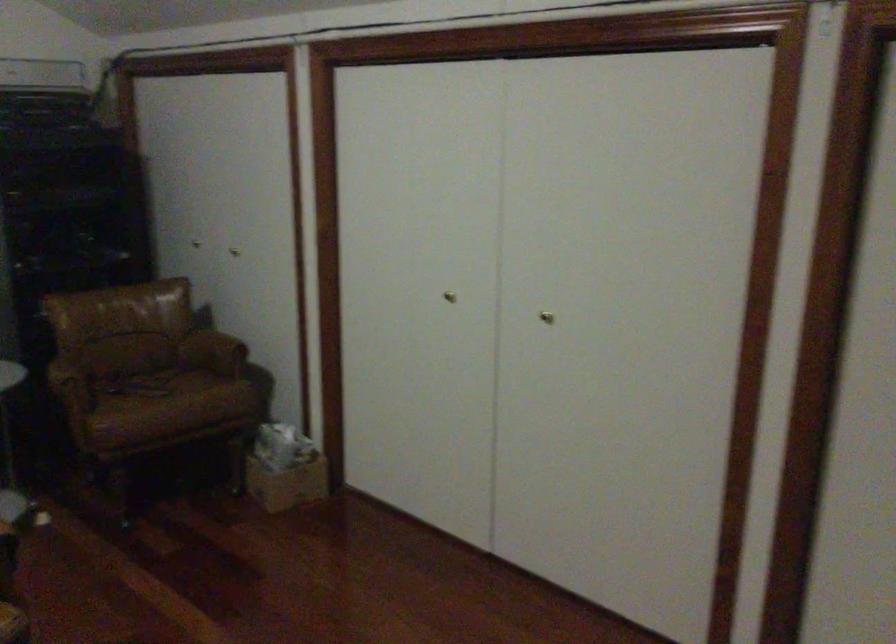
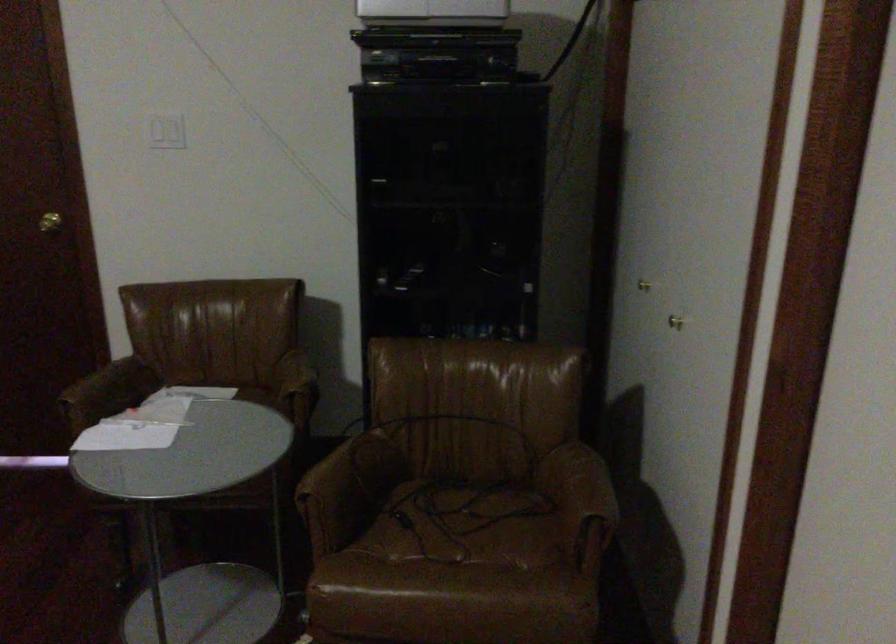
Locate, in the second image, the point that corresponds to pixel 72 388 in the first image.

(312, 513)